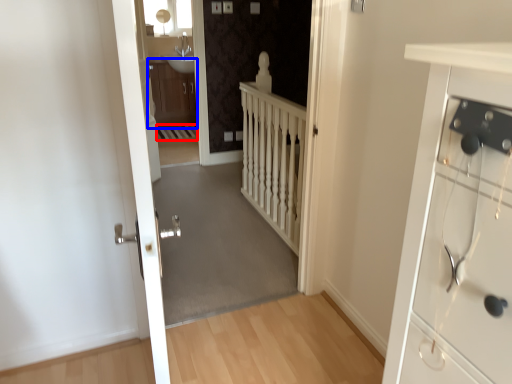
Question: Which of the following is the closest to the observer, stairwell (highlighted by a red box) or cabinetry (highlighted by a blue box)?

Choices:
 (A) stairwell
 (B) cabinetry

Answer: (A)